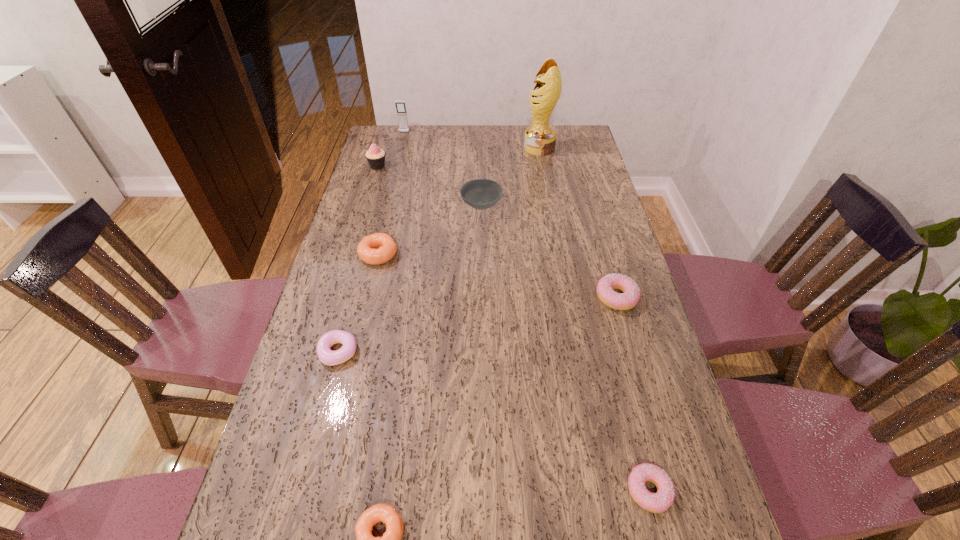
This screenshot has height=540, width=960. Find the location of `blank area located on the front of the fourth tallest object`. blank area located on the front of the fourth tallest object is located at coordinates (482, 289).

Locate an element on the screen. This screenshot has width=960, height=540. free space located 0.170m on the front of the fifth nearest object is located at coordinates (366, 312).

This screenshot has height=540, width=960. What are the coordinates of `vacant area located on the left of the second farthest doughnut` in the screenshot? It's located at (510, 297).

Find the location of a particular element. The image size is (960, 540). free space located 0.330m on the back of the purple doughnut is located at coordinates (366, 251).

In order to click on vacant region located 0.090m on the back of the smaller pink doughnut in this screenshot , I will do `click(633, 426)`.

This screenshot has height=540, width=960. Find the location of `award located in the far edge section of the desktop`. award located in the far edge section of the desktop is located at coordinates (540, 138).

At what (x,y) coordinates should I click in order to perform the action: click on cellular telephone situated at the far edge. Please return your answer as a coordinate pair (x, y). The height and width of the screenshot is (540, 960). Looking at the image, I should click on (400, 105).

The width and height of the screenshot is (960, 540). What are the coordinates of `cellular telephone located in the left edge section of the desktop` in the screenshot? It's located at point(400,105).

Identify the location of cupcake at the left edge. Image resolution: width=960 pixels, height=540 pixels. (375, 156).

The width and height of the screenshot is (960, 540). Find the location of `award located at the right edge`. award located at the right edge is located at coordinates (540, 138).